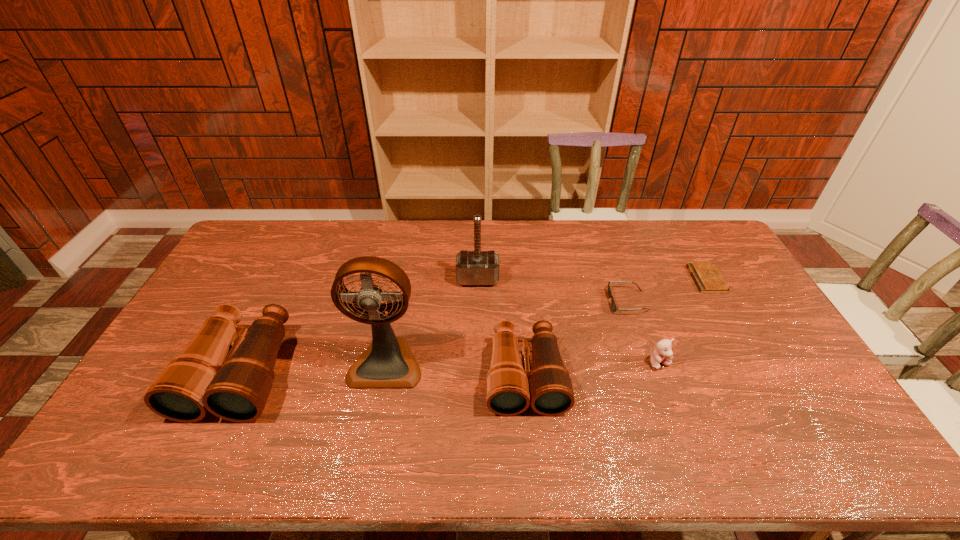
At what (x,y) coordinates should I click in order to perform the action: click on free point between the hammer and the shortest object. Please return your answer as a coordinate pair (x, y). The image size is (960, 540). Looking at the image, I should click on (592, 279).

Find the location of a particular element. The width and height of the screenshot is (960, 540). vacant region between the rightmost object and the teddy bear is located at coordinates tap(684, 321).

Where is `blank region between the sunglasses and the second tallest object`? blank region between the sunglasses and the second tallest object is located at coordinates (553, 290).

Where is `vacant space in between the sixth object from right to left and the leftmost object`? This screenshot has height=540, width=960. vacant space in between the sixth object from right to left and the leftmost object is located at coordinates (313, 367).

I want to click on free space between the leftmost object and the hammer, so click(359, 326).

Identify the location of blank region between the left binoculars and the teddy bear. Image resolution: width=960 pixels, height=540 pixels. (450, 368).

Locate which object is the fourth closest to the right binoculars. Please provide its 2D coordinates. Your answer should be formatted as a tuple, i.e. [(x, y)], where the tuple contains the x and y coordinates of a point satisfying the conditions above.

[(663, 354)]

Image resolution: width=960 pixels, height=540 pixels. What are the coordinates of `object that is the fifth nearest to the teddy bear` in the screenshot? It's located at (388, 362).

At what (x,y) coordinates should I click in order to perform the action: click on vacant area that satisfies the following two spatial constraints: 1. on the spine side of the shortest object; 2. through the lenses of the taller binoculars. Please return your answer as a coordinate pair (x, y). Looking at the image, I should click on (759, 372).

Where is `free space in the image that satisfies the following two spatial constraints: 1. on the spine side of the shortest object; 2. through the lenses of the right binoculars`? Image resolution: width=960 pixels, height=540 pixels. free space in the image that satisfies the following two spatial constraints: 1. on the spine side of the shortest object; 2. through the lenses of the right binoculars is located at coordinates (761, 376).